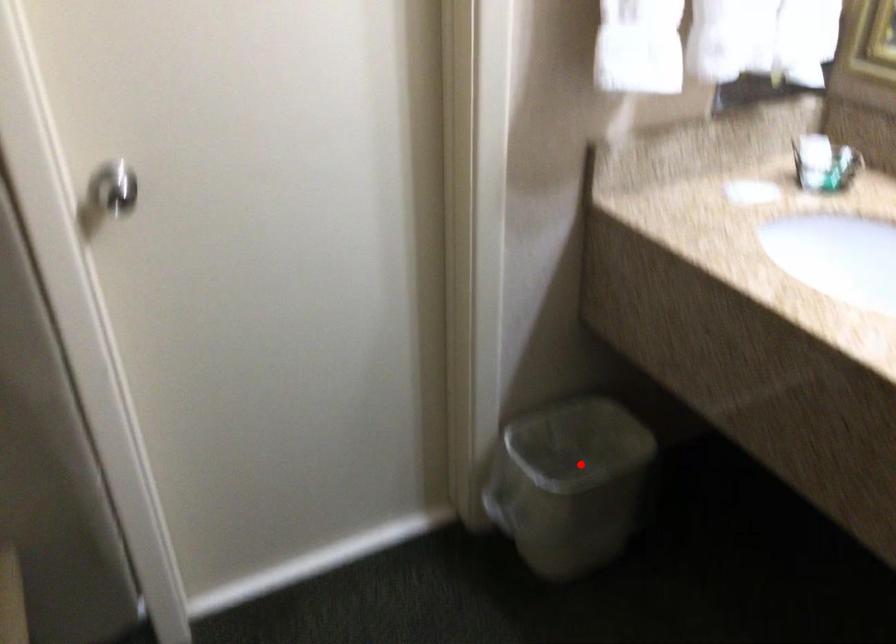
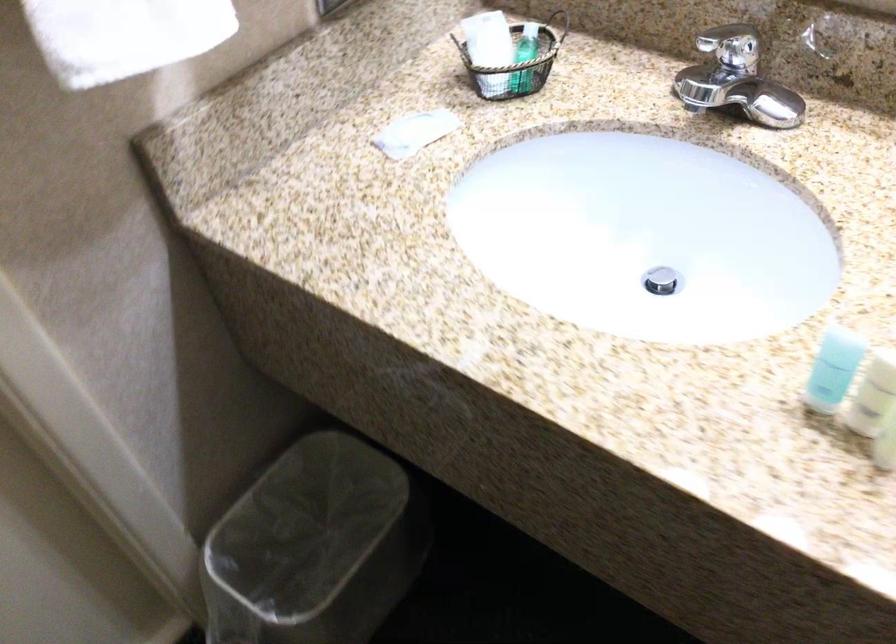
Where in the second image is the point corresponding to the highlighted location from the first image?

(314, 547)